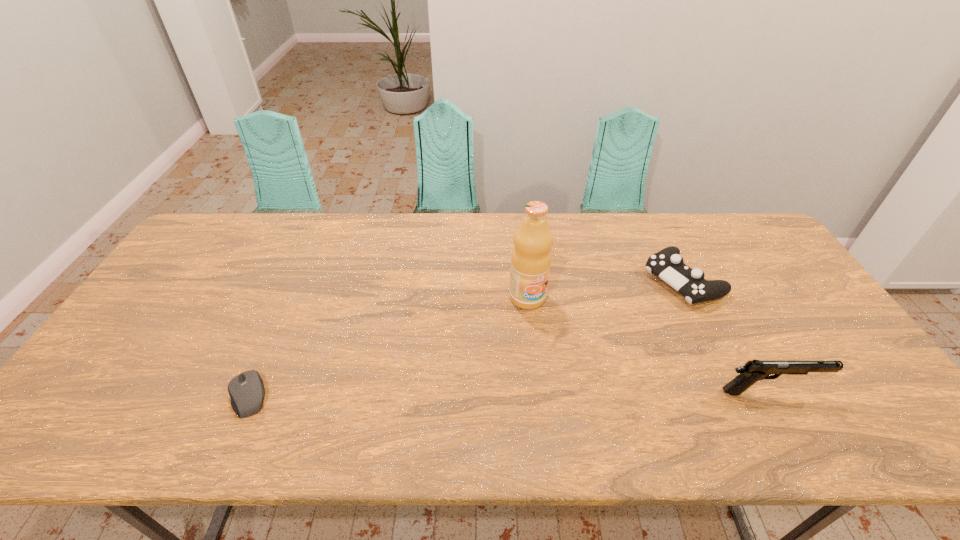
You are a GUI agent. You are given a task and a screenshot of the screen. Output one action in this format:
    pyautogui.click(x=<x>, y=<y>)
    Task: Click on the vacant area situated 0.120m on the front label of the fruit juice
    The width and height of the screenshot is (960, 540).
    Given the screenshot: What is the action you would take?
    pyautogui.click(x=555, y=342)

This screenshot has height=540, width=960. I want to click on vacant area situated 0.210m on the surface of the control, so click(603, 323).

At what (x,y) coordinates should I click in order to perform the action: click on vacant space located on the surface of the control. Please return your answer as a coordinate pair (x, y). The width and height of the screenshot is (960, 540). Looking at the image, I should click on (619, 315).

Where is `free space located on the surface of the control`? Image resolution: width=960 pixels, height=540 pixels. free space located on the surface of the control is located at coordinates (609, 321).

Where is `object that is positioned at the far edge`? object that is positioned at the far edge is located at coordinates (667, 264).

Where is `computer equipment that is at the near edge`? The height and width of the screenshot is (540, 960). computer equipment that is at the near edge is located at coordinates pos(246,390).

You are a GUI agent. You are given a task and a screenshot of the screen. Output one action in this format:
    pyautogui.click(x=<x>, y=<y>)
    Task: Click on the gun that is at the near edge
    This screenshot has height=540, width=960.
    Given the screenshot: What is the action you would take?
    pyautogui.click(x=754, y=370)

Find the location of a particular element. object that is at the right edge is located at coordinates (754, 370).

Image resolution: width=960 pixels, height=540 pixels. Identify the location of object at the near right corner. (754, 370).

In order to click on free spot at the far edge of the desktop in this screenshot , I will do `click(357, 238)`.